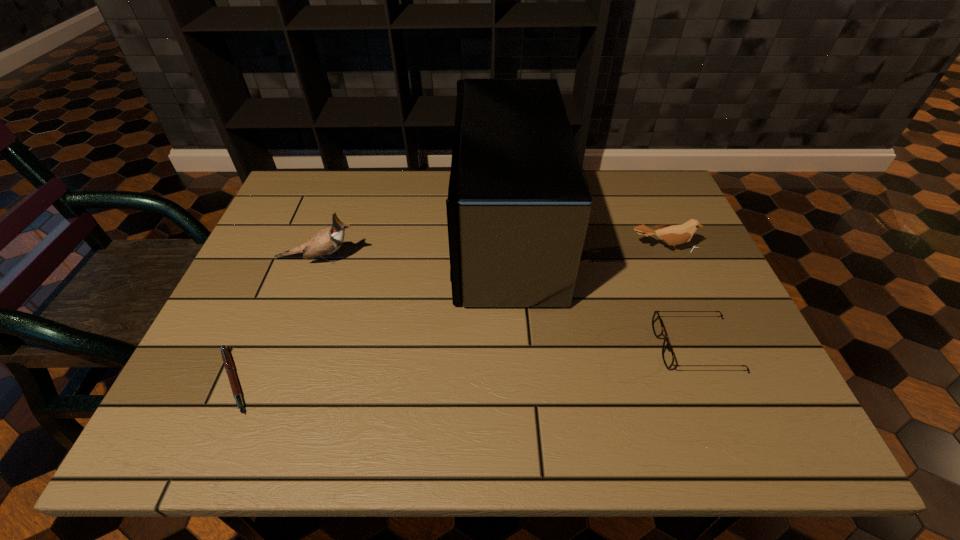
You are a GUI agent. You are given a task and a screenshot of the screen. Output one action in this format:
    pyautogui.click(x=<x>, y=<y>)
    Task: Click on the pen present at the left edge
    The width and height of the screenshot is (960, 540).
    Given the screenshot: What is the action you would take?
    [228, 364]

Where is `bird at the right edge`? Image resolution: width=960 pixels, height=540 pixels. bird at the right edge is located at coordinates (674, 235).

The image size is (960, 540). I want to click on sunglasses that is at the right edge, so click(667, 354).

The width and height of the screenshot is (960, 540). I want to click on object that is positioned at the near left corner, so click(228, 364).

What are the coordinates of `vacant region at the far edge` in the screenshot? It's located at click(x=604, y=183).

This screenshot has width=960, height=540. Identify the location of free space at the near edge of the desktop. (685, 426).

Where is `vacant point at the left edge`? Image resolution: width=960 pixels, height=540 pixels. vacant point at the left edge is located at coordinates (256, 311).

In the image, there is a desktop. At what (x,y) coordinates should I click in order to perform the action: click on free space at the right edge. Please return your answer as a coordinate pair (x, y). The width and height of the screenshot is (960, 540). Looking at the image, I should click on (678, 221).

Locate an element on the screen. free space at the far right corner is located at coordinates (x=641, y=177).

Find the location of a particular element. The height and width of the screenshot is (540, 960). vacant space in between the shortest object and the sunglasses is located at coordinates (465, 363).